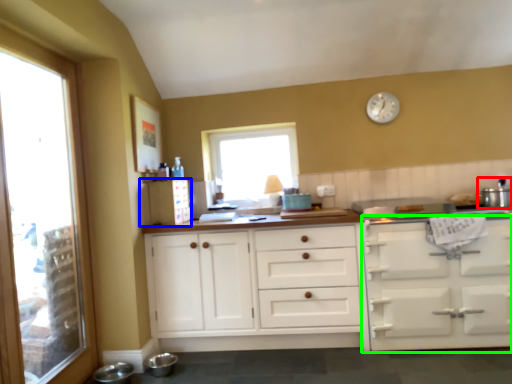
Question: Based on their relative distances, which object is nearer to appliance (highlighted by a red box)? Choose from appliance (highlighted by a blue box) and cabinetry (highlighted by a green box).

Choices:
 (A) appliance
 (B) cabinetry

Answer: (B)